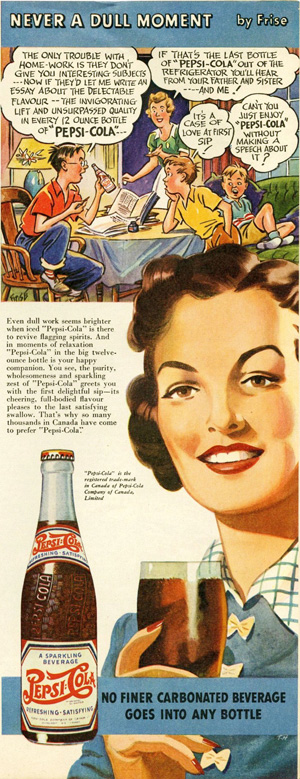
Find the location of `clear glass`. clear glass is located at coordinates (184, 566).